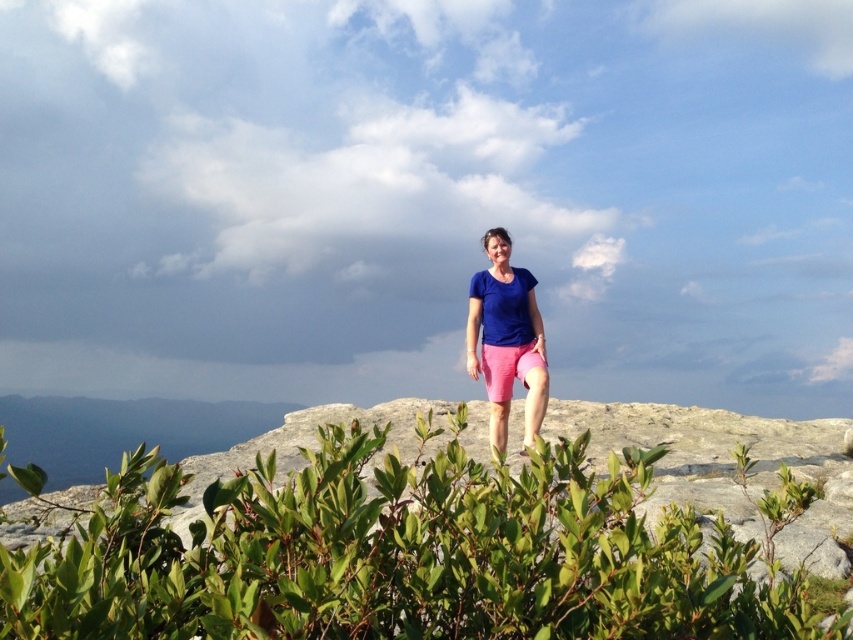
You are a photographer positioned at the camera location. You want to capture both the point at coordinates point (805, 576) and the point at coordinates point (509, 387) in your shot. Which point should you focus on first to ensure both are in focus?

You should focus on point (805, 576) first because it is closer to the viewer than point (509, 387). By focusing on the closer point, the farther point may still be within the depth of field, ensuring both are in focus.

You are a hiker who wants to take a photo of the green leafy shrub at center. According to the coordinates provided, where should you position your camera to capture it in the frame?

The green leafy shrub at center is located at coordinates point (405,554), so you should position your camera to aim towards that point to capture it in the frame.